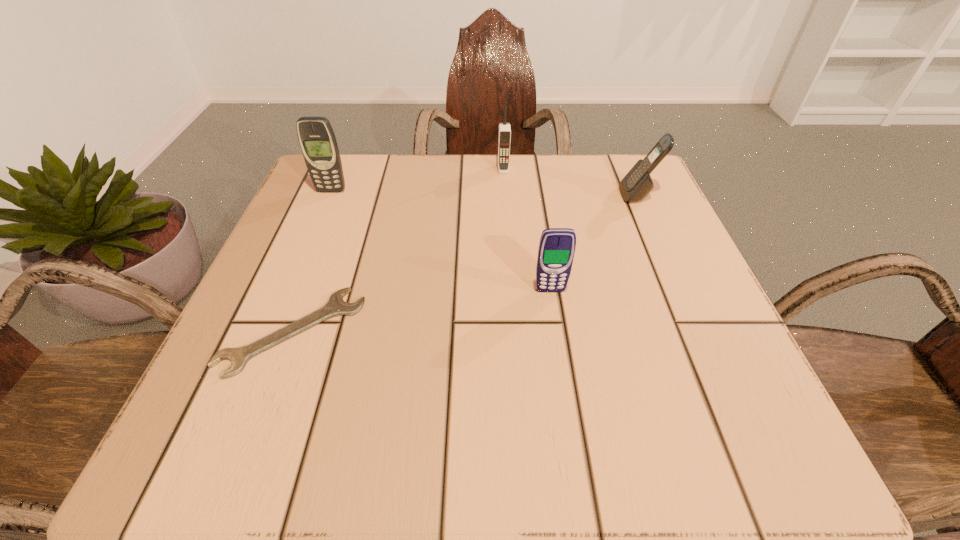
Identify the location of vacant space that satisfies the following two spatial constraints: 1. on the screen of the shortest object; 2. on the left side of the leftmost cellular telephone. This screenshot has height=540, width=960. (273, 332).